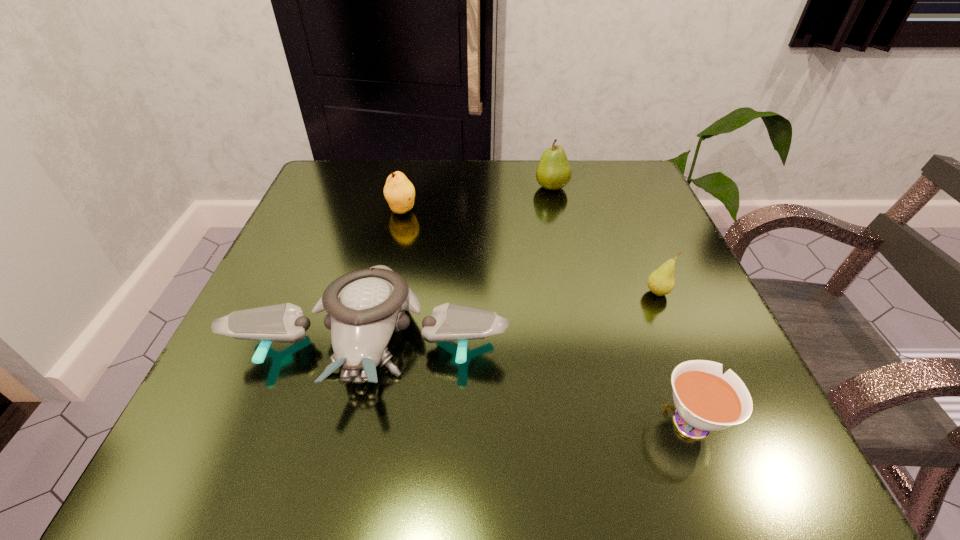
Where is `blank space located on the front-facing side of the drone`? The height and width of the screenshot is (540, 960). blank space located on the front-facing side of the drone is located at coordinates (341, 468).

Identify the location of vacant space positioned on the side of the teacup with the handle. The width and height of the screenshot is (960, 540). (644, 300).

The image size is (960, 540). I want to click on free spot located 0.250m on the side of the teacup with the handle, so click(633, 268).

The width and height of the screenshot is (960, 540). Find the location of `free spot located on the side of the teacup with the handle`. free spot located on the side of the teacup with the handle is located at coordinates (653, 322).

This screenshot has height=540, width=960. I want to click on object positioned at the near edge, so click(x=705, y=400).

I want to click on object that is at the left edge, so click(x=365, y=307).

The image size is (960, 540). Find the location of `pear that is at the right edge`. pear that is at the right edge is located at coordinates (661, 281).

Locate an element on the screen. The height and width of the screenshot is (540, 960). teacup that is positioned at the right edge is located at coordinates (705, 400).

Locate an element on the screen. object located in the near right corner section of the desktop is located at coordinates (705, 400).

At what (x,y) coordinates should I click in order to perform the action: click on free region at the far edge of the desktop. Please return your answer as a coordinate pair (x, y). The width and height of the screenshot is (960, 540). Looking at the image, I should click on (459, 217).